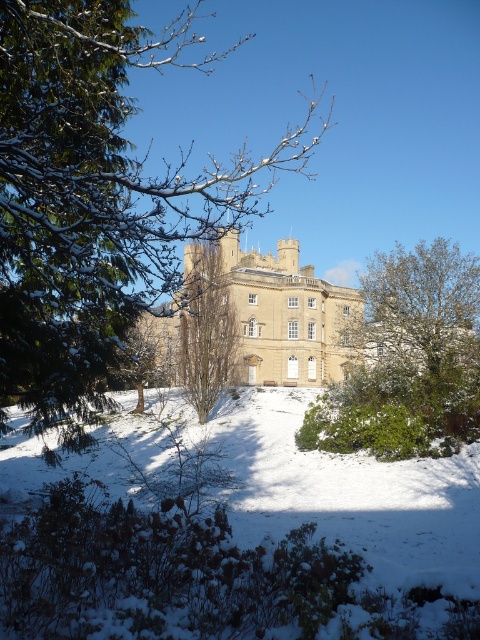
Which is above, green textured tree at upper left or beige stone castle at center?

green textured tree at upper left is above.

At what (x,y) coordinates should I click in order to perform the action: click on green textured tree at upper left. Please return your answer as a coordinate pair (x, y). Looking at the image, I should click on (97, 200).

Where is `green textured tree at upper left`? The image size is (480, 640). green textured tree at upper left is located at coordinates (97, 200).

Who is positioned more to the left, green textured tree at upper left or brown textured tree at center?

green textured tree at upper left

Is green textured tree at upper left thinner than brown textured tree at center?

In fact, green textured tree at upper left might be wider than brown textured tree at center.

Locate an element on the screen. This screenshot has height=640, width=480. green textured tree at upper left is located at coordinates point(97,200).

The image size is (480, 640). I want to click on green textured tree at upper left, so click(x=97, y=200).

Does green leafy bush at lower right appear under beige stone castle at center?

Correct, green leafy bush at lower right is located below beige stone castle at center.

Is green leafy bush at lower right above beige stone castle at center?

No, green leafy bush at lower right is not above beige stone castle at center.

Does point (424, 378) lie in front of point (283, 320)?

That is True.

In order to click on green leafy bush at lower right in this screenshot , I will do `click(422, 337)`.